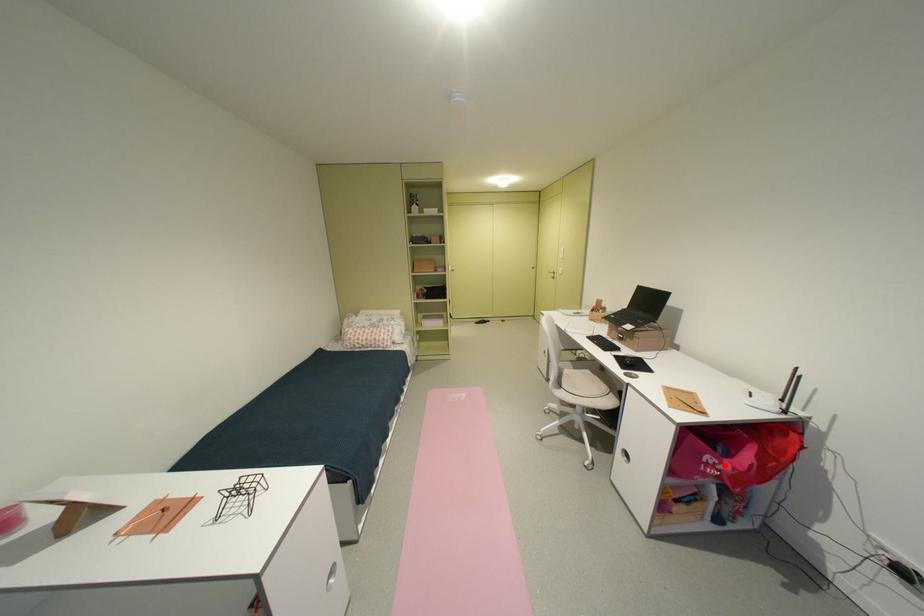
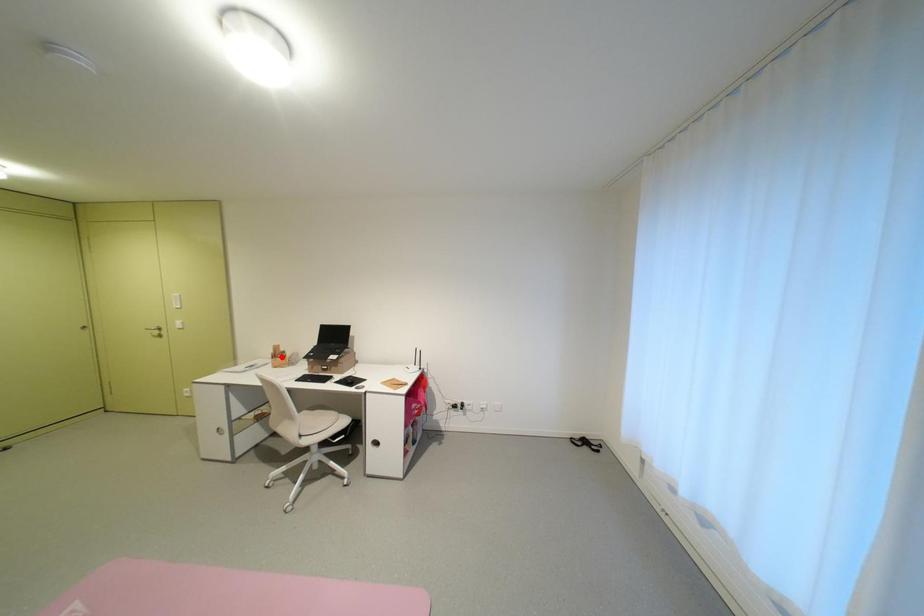
I am providing you with two images of the same scene from different viewpoints. A red point is marked on the first image and another point is marked on the second image. Does the point marked in image1 correspond to the same location as the one in image2?

No